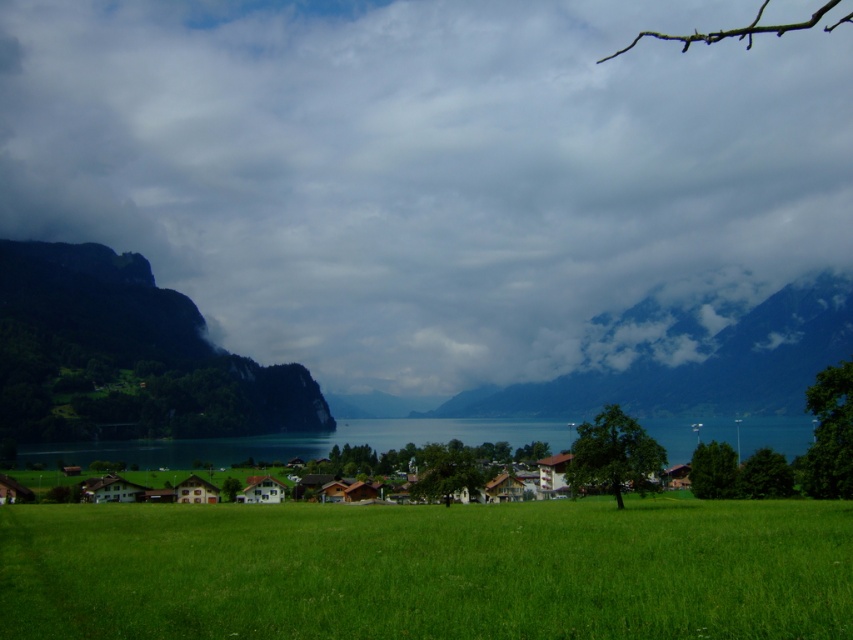
You are a hiker who wants to cross from the left side to the right side of the image. The green grassy field at center and the clear blue water at center are in your path. Which one should you avoid stepping on if you want to stay dry?

You should avoid stepping on the clear blue water at center because the green grassy field at center is taller than the clear blue water at center, so the water is likely shallower and may not fully submerge your feet, but the grass is taller and could be wet near the water. Alternatively, the grass might be drier depending on the terrain. However, based on the given information, the water is shorter, so stepping on the grass would keep you drier.

You are planning to set up a tent for a camping trip. You have two options for the location based on the image provided. The first option is on the green grassy field at center, and the second is near the cloudy gray mountain at center. Considering the width of the areas, which location would allow for a wider setup area?

The green grassy field at center is thinner than the cloudy gray mountain at center, so the cloudy gray mountain at center offers a wider setup area for the tent.

You are standing in the middle of the green grassy field at center and want to walk towards the cloudy gray mountain at center. Which direction should you head?

You should head to the right because the cloudy gray mountain at center is to the right of the green grassy field at center.